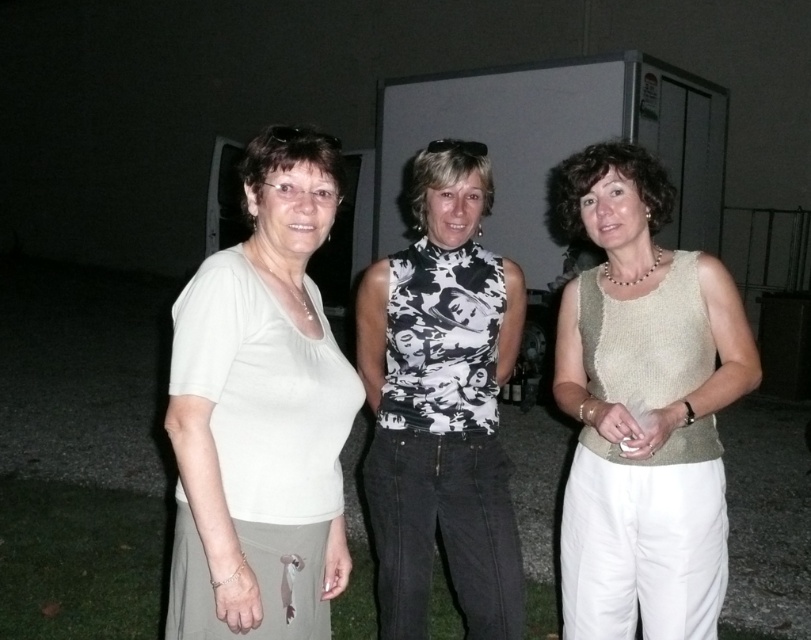
Question: Considering the real-world distances, which object is farthest from the white matte shirt at left?

Choices:
 (A) knitted beige vest at center
 (B) black printed tank top at center

Answer: (A)

Question: Is the position of white matte shirt at left less distant than that of black printed tank top at center?

Choices:
 (A) no
 (B) yes

Answer: (B)

Question: Observing the image, what is the correct spatial positioning of knitted beige vest at center in reference to black printed tank top at center?

Choices:
 (A) right
 (B) left

Answer: (A)

Question: Which point is closer to the camera?

Choices:
 (A) (277, 420)
 (B) (721, 332)
 (C) (400, 317)

Answer: (A)

Question: Among these objects, which one is nearest to the camera?

Choices:
 (A) black printed tank top at center
 (B) white matte shirt at left
 (C) knitted beige vest at center

Answer: (B)

Question: Is white matte shirt at left positioned before knitted beige vest at center?

Choices:
 (A) yes
 (B) no

Answer: (A)